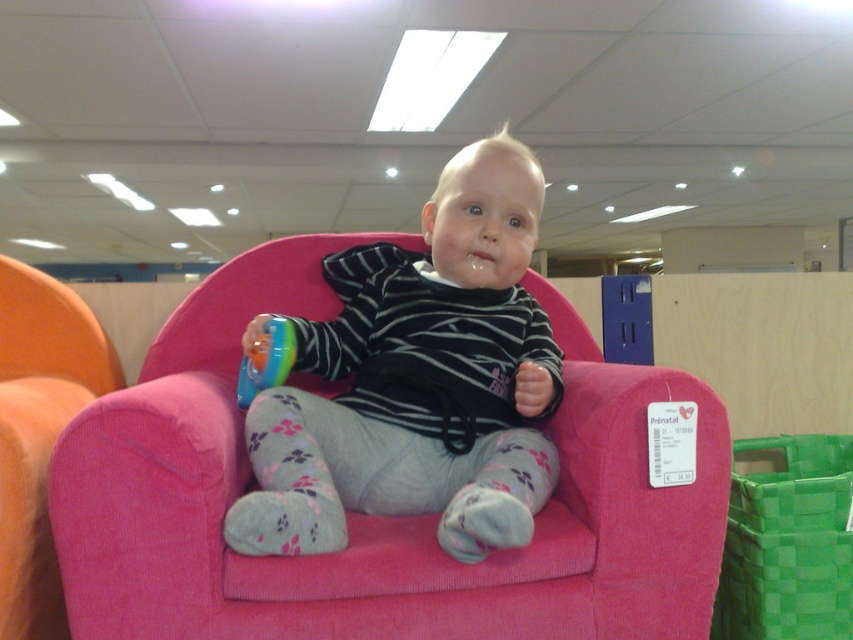
In the scene shown: Is matte black and gray striped shirt at center bigger than gray floral sock at lower center?

Yes, matte black and gray striped shirt at center is bigger than gray floral sock at lower center.

Who is higher up, matte black and gray striped shirt at center or gray floral sock at lower center?

matte black and gray striped shirt at center

Describe the element at coordinates (418, 381) in the screenshot. I see `matte black and gray striped shirt at center` at that location.

Locate an element on the screen. matte black and gray striped shirt at center is located at coordinates (418, 381).

Is floral-patterned sock at lower center positioned at the back of translucent plastic toy at center?

No, it is not.

Can you confirm if floral-patterned sock at lower center is positioned below translucent plastic toy at center?

Correct, floral-patterned sock at lower center is located below translucent plastic toy at center.

You are a GUI agent. You are given a task and a screenshot of the screen. Output one action in this format:
    pyautogui.click(x=<x>, y=<y>)
    Task: Click on the floral-patterned sock at lower center
    Image resolution: width=853 pixels, height=640 pixels.
    Given the screenshot: What is the action you would take?
    pyautogui.click(x=292, y=476)

Is point (4, 556) farther from viewer compared to point (337, 458)?

No, (4, 556) is closer to viewer.

Is orange fabric armchair at left taller than floral-patterned sock at lower center?

Yes.

Does point (21, 288) come closer to viewer compared to point (287, 486)?

No, (21, 288) is further to viewer.

The image size is (853, 640). What are the coordinates of `orange fabric armchair at left` in the screenshot? It's located at (39, 433).